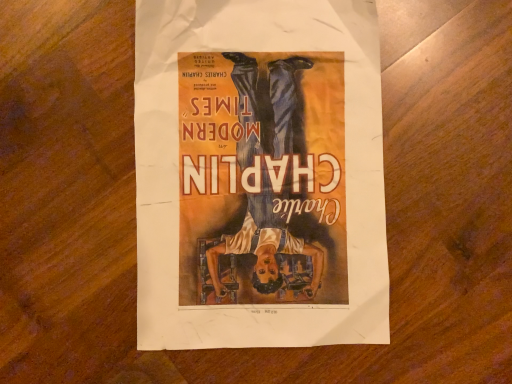
Identify the location of matte paper poster at center. (259, 174).

The height and width of the screenshot is (384, 512). What do you see at coordinates (259, 174) in the screenshot? I see `matte paper poster at center` at bounding box center [259, 174].

In order to face matte paper poster at center, should I rotate leftwards or rightwards?

To face it directly, rotate right by 0.560 degrees.

This screenshot has height=384, width=512. Identify the location of matte paper poster at center. (259, 174).